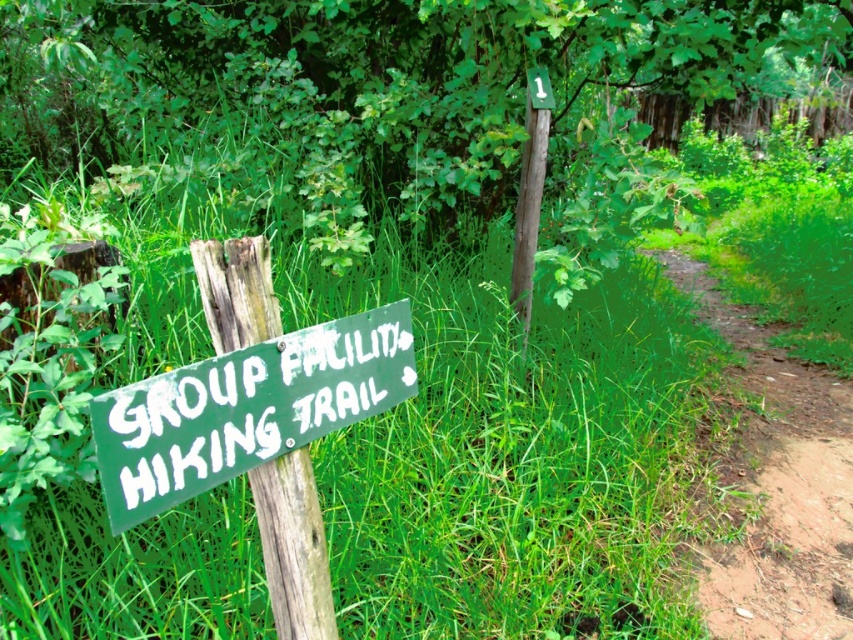
Can you confirm if green wood post at center is taller than brown dirt trail at center-right?

Correct, green wood post at center is much taller as brown dirt trail at center-right.

How distant is green wood post at center from brown dirt trail at center-right?

green wood post at center and brown dirt trail at center-right are 6.47 feet apart from each other.

Is point (363, 29) farther from camera compared to point (822, 404)?

No, (363, 29) is closer to viewer.

You are a GUI agent. You are given a task and a screenshot of the screen. Output one action in this format:
    pyautogui.click(x=<x>, y=<y>)
    Task: Click on the green wood post at center
    
    Given the screenshot: What is the action you would take?
    pyautogui.click(x=373, y=83)

Is green painted wood sign at left wider than green wood signpost at left?

Yes.

Does point (277, 348) come closer to viewer compared to point (241, 280)?

No, (277, 348) is behind (241, 280).

This screenshot has width=853, height=640. Describe the element at coordinates (245, 408) in the screenshot. I see `green painted wood sign at left` at that location.

Where is `green painted wood sign at left`? The height and width of the screenshot is (640, 853). green painted wood sign at left is located at coordinates (245, 408).

Looking at this image, between green wood post at center and green painted wood sign at left, which one has less height?

With less height is green painted wood sign at left.

Between point (38, 68) and point (177, 396), which one is positioned behind?

Point (38, 68)

Where is `green wood post at center`? The height and width of the screenshot is (640, 853). green wood post at center is located at coordinates (373, 83).